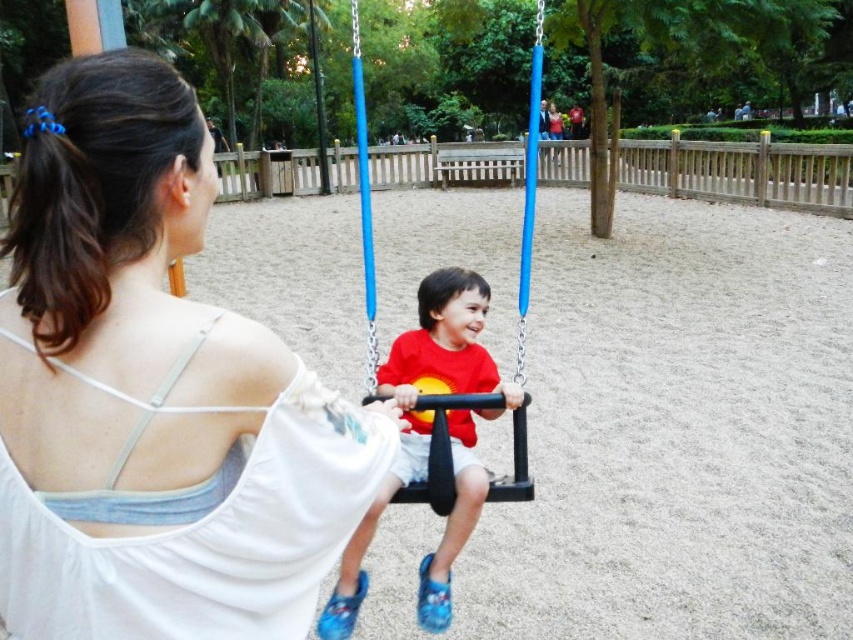
Consider the image. Is red matte shirt at center further to the viewer compared to matte plastic swing at center?

No, red matte shirt at center is in front of matte plastic swing at center.

Which is behind, point (486, 307) or point (444, 412)?

The point (486, 307) is more distant.

Does point (422, 592) come closer to viewer compared to point (521, 225)?

Yes, it is.

I want to click on red matte shirt at center, so click(419, 410).

Can you confirm if white fabric at center is shorter than red matte shirt at center?

Yes.

Is white fabric at center positioned at the back of red matte shirt at center?

No.

Where is `white fabric at center`? The height and width of the screenshot is (640, 853). white fabric at center is located at coordinates (152, 392).

Does white fabric at center have a greater width compared to matte plastic swing at center?

Incorrect, white fabric at center's width does not surpass matte plastic swing at center's.

Locate an element on the screen. Image resolution: width=853 pixels, height=640 pixels. white fabric at center is located at coordinates (152, 392).

The image size is (853, 640). Describe the element at coordinates (152, 392) in the screenshot. I see `white fabric at center` at that location.

The height and width of the screenshot is (640, 853). I want to click on white fabric at center, so click(152, 392).